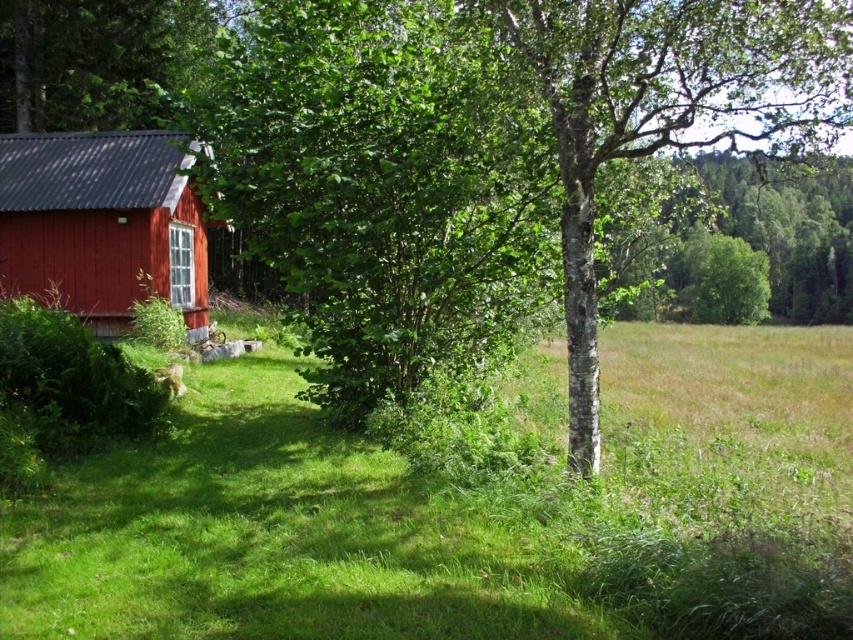
Who is taller, matte wooden barn at left or green leafy tree at upper left?

Standing taller between the two is matte wooden barn at left.

Between matte wooden barn at left and green leafy tree at upper left, which one is positioned lower?

matte wooden barn at left

Is point (9, 192) in front of point (39, 19)?

Yes.

This screenshot has height=640, width=853. Identify the location of matte wooden barn at left. (102, 224).

Can you confirm if green grassy at lower left is positioned above matte wooden barn at left?

Actually, green grassy at lower left is below matte wooden barn at left.

Consider the image. Who is shorter, green grassy at lower left or matte wooden barn at left?

green grassy at lower left is shorter.

Find the location of `green grassy at lower left`. green grassy at lower left is located at coordinates (276, 536).

Image resolution: width=853 pixels, height=640 pixels. Describe the element at coordinates (479, 150) in the screenshot. I see `green leafy tree at center` at that location.

Between point (381, 388) and point (22, 3), which one is positioned in front?

Point (381, 388)

You are a GUI agent. You are given a task and a screenshot of the screen. Output one action in this format:
    pyautogui.click(x=<x>, y=<y>)
    Task: Click on the green leafy tree at center
    Image resolution: width=853 pixels, height=640 pixels.
    Given the screenshot: What is the action you would take?
    pyautogui.click(x=479, y=150)